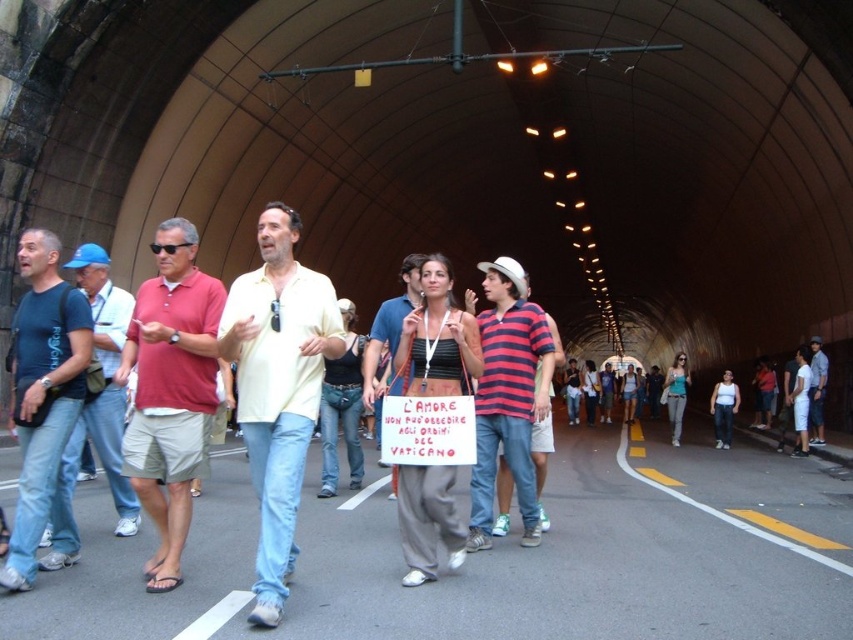
Question: Does matte blue t-shirt at left appear over matte yellow shirt at center?

Choices:
 (A) yes
 (B) no

Answer: (A)

Question: Is striped cotton shirt at center to the right of blue denim jeans at left from the viewer's perspective?

Choices:
 (A) no
 (B) yes

Answer: (B)

Question: Observing the image, what is the correct spatial positioning of matte red polo shirt at center left in reference to striped cotton shirt at center?

Choices:
 (A) below
 (B) above

Answer: (B)

Question: Among these points, which one is farthest from the camera?

Choices:
 (A) (71, 264)
 (B) (306, 320)

Answer: (A)

Question: Which of these objects is positioned closest to the denim shorts at center?

Choices:
 (A) striped cotton shirt at center
 (B) matte blue t-shirt at left
 (C) light yellow shirt at center
 (D) blue denim jeans at left

Answer: (A)

Question: Which is farther from the matte blue t-shirt at left?

Choices:
 (A) light yellow shirt at center
 (B) denim shorts at center
 (C) matte yellow shirt at center

Answer: (B)